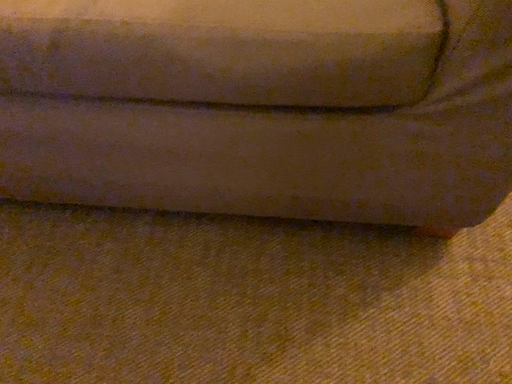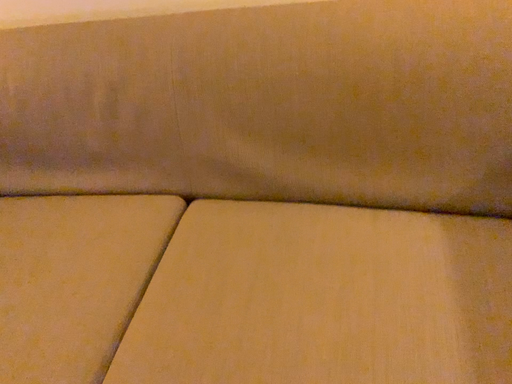
Question: Which way did the camera rotate in the video?

Choices:
 (A) rotated downward
 (B) rotated upward

Answer: (B)